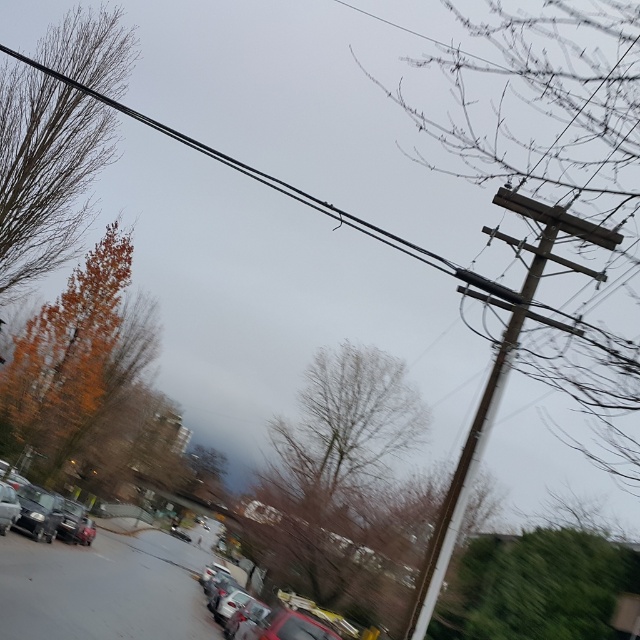
You are a delivery drone that needs to fly from the bare wood pole at upper right to the metallic red car at center. Considering the height difference between them, will you need to ascend or descend while flying towards the car?

The bare wood pole at upper right is much taller than the metallic red car at center, so you will need to descend while flying towards the metallic red car at center.

You are a pedestrian standing at the center of the street looking towards the right side. Which object, the bare wood pole at upper right or the brown wooden telegraph pole at right, would appear closer to you?

The bare wood pole at upper right appears closer because it is in front of the brown wooden telegraph pole at right.

You are a pedestrian standing on the sidewalk and looking at the street scene. You see the bare wood pole at upper right and the metallic red car at center. Which object is higher in the image?

The bare wood pole at upper right is higher in the image than the metallic red car at center because it is positioned above it.